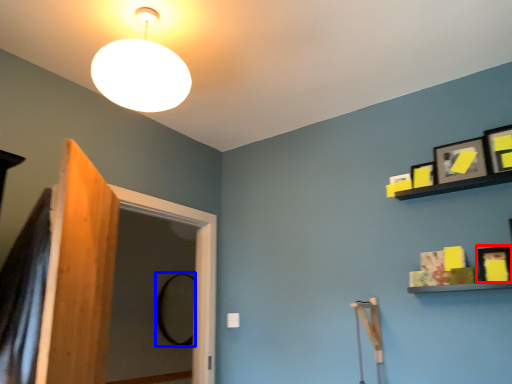
Question: Which object appears closest to the camera in this image, picture frame (highlighted by a red box) or mirror (highlighted by a blue box)?

Choices:
 (A) picture frame
 (B) mirror

Answer: (A)